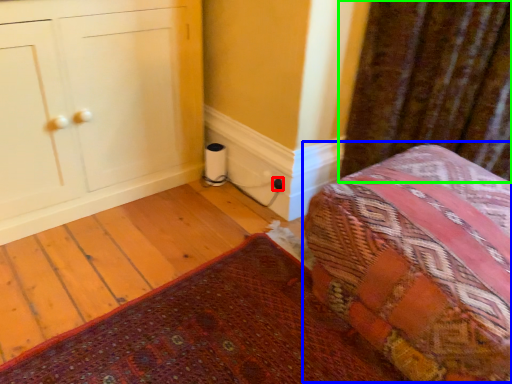
Question: Estimate the real-world distances between objects in this image. Which object is closer to electric outlet (highlighted by a red box), bed (highlighted by a blue box) or curtain (highlighted by a green box)?

Choices:
 (A) bed
 (B) curtain

Answer: (B)